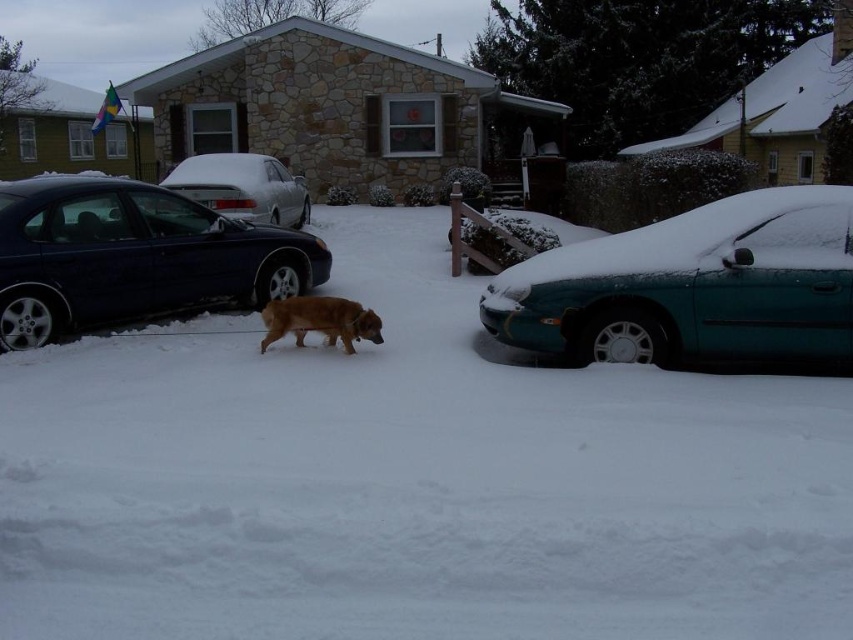
Is teal glossy sedan at right positioned at the back of shiny blue sedan at left?

No, it is not.

Does point (846, 205) come farther from viewer compared to point (196, 305)?

No, it is not.

Image resolution: width=853 pixels, height=640 pixels. I want to click on teal glossy sedan at right, so click(x=692, y=285).

This screenshot has width=853, height=640. What are the coordinates of `shiny blue sedan at left` in the screenshot? It's located at (132, 257).

Does shiny blue sedan at left have a smaller size compared to fuzzy brown dog at center?

Correct, shiny blue sedan at left occupies less space than fuzzy brown dog at center.

Where is `shiny blue sedan at left`? shiny blue sedan at left is located at coordinates (132, 257).

Image resolution: width=853 pixels, height=640 pixels. What are the coordinates of `shiny blue sedan at left` in the screenshot? It's located at (132, 257).